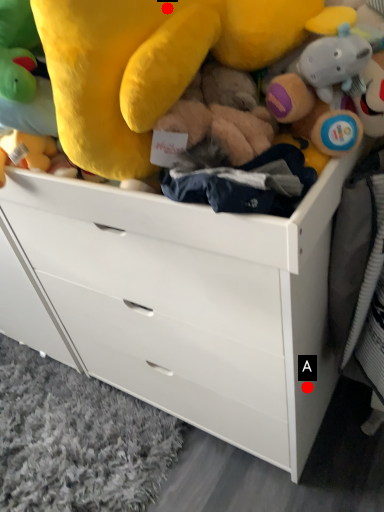
Question: Two points are circled on the image, labeled by A and B beside each circle. Which of the following is the closest to the observer?

Choices:
 (A) A is closer
 (B) B is closer

Answer: (B)